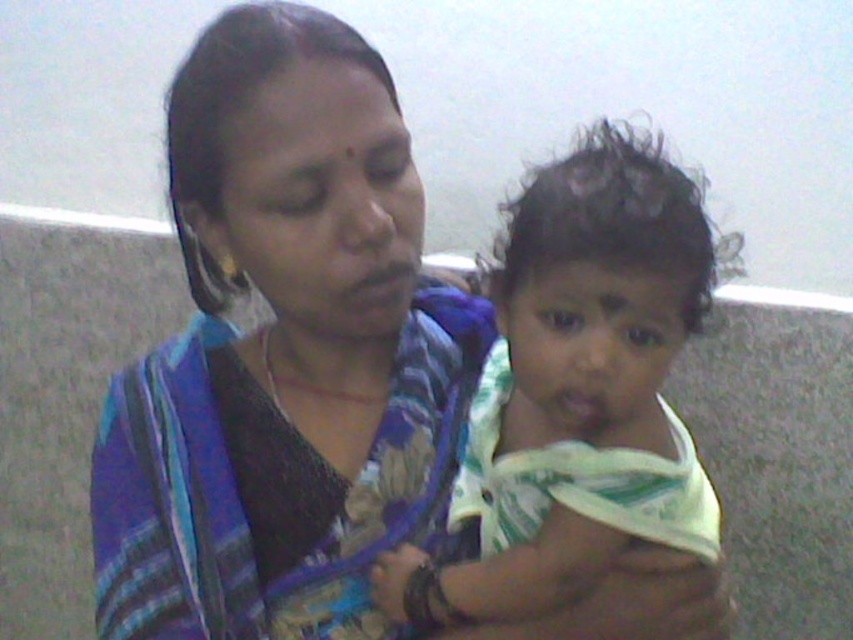
Is blue striped sari at center positioned at the back of white cotton cloth at center?

Yes, blue striped sari at center is behind white cotton cloth at center.

Does blue striped sari at center have a greater height compared to white cotton cloth at center?

Correct, blue striped sari at center is much taller as white cotton cloth at center.

Where is `blue striped sari at center`? The width and height of the screenshot is (853, 640). blue striped sari at center is located at coordinates (285, 355).